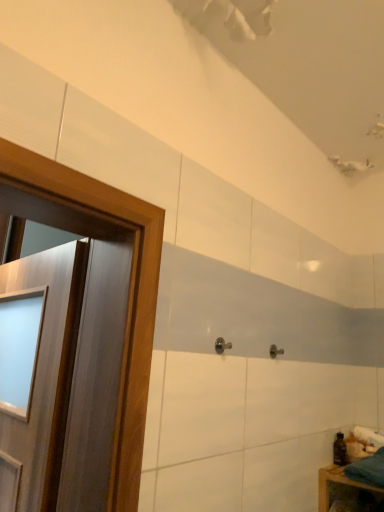
The width and height of the screenshot is (384, 512). In order to click on satin nickel door handle at center in this screenshot , I will do [x=221, y=345].

Where is `teal fabric at lower right`? The width and height of the screenshot is (384, 512). teal fabric at lower right is located at coordinates (346, 492).

The height and width of the screenshot is (512, 384). Describe the element at coordinates (46, 370) in the screenshot. I see `wooden door at left` at that location.

Locate an element on the screen. The height and width of the screenshot is (512, 384). satin nickel door handle at center is located at coordinates (221, 345).

In terms of size, does transparent plastic bottle at lower right appear bigger or smaller than wooden door at left?

In the image, transparent plastic bottle at lower right appears to be smaller than wooden door at left.

Would you say transparent plastic bottle at lower right is outside wooden door at left?

Yes, transparent plastic bottle at lower right is not within wooden door at left.

What's the angular difference between transparent plastic bottle at lower right and wooden door at left's facing directions?

9.71 degrees separate the facing orientations of transparent plastic bottle at lower right and wooden door at left.

Which is closer, (342, 435) or (46, 320)?

Positioned in front is point (46, 320).

From a real-world perspective, does teal fabric at lower right sit lower than transparent plastic bottle at lower right?

Yes, from a real-world perspective, teal fabric at lower right is below transparent plastic bottle at lower right.

Are teal fabric at lower right and transparent plastic bottle at lower right making contact?

There is a gap between teal fabric at lower right and transparent plastic bottle at lower right.

Considering the relative positions of teal fabric at lower right and transparent plastic bottle at lower right in the image provided, is teal fabric at lower right behind transparent plastic bottle at lower right?

No, teal fabric at lower right is in front of transparent plastic bottle at lower right.

Is point (319, 475) closer to viewer compared to point (341, 464)?

Yes, point (319, 475) is closer to viewer.

Is teal fabric at lower right taller than wooden door at left?

Incorrect, the height of teal fabric at lower right is not larger of that of wooden door at left.

From the image's perspective, is teal fabric at lower right on top of wooden door at left?

Incorrect, from the image's perspective, teal fabric at lower right is lower than wooden door at left.

Does point (354, 487) appear closer or farther from the camera than point (12, 456)?

Point (354, 487).

Is teal fabric at lower right positioned before wooden door at left?

No, it is behind wooden door at left.

From the image's perspective, would you say teal fabric at lower right is shown under satin nickel door handle at center?

Yes.

Which is nearer, [355,487] or [228,342]?

Point [228,342]

Is teal fabric at lower right bigger than satin nickel door handle at center?

Yes.

Is satin nickel door handle at center not inside wooden door at left?

Indeed, satin nickel door handle at center is completely outside wooden door at left.

From their relative heights in the image, would you say satin nickel door handle at center is taller or shorter than wooden door at left?

In the image, satin nickel door handle at center appears to be shorter than wooden door at left.

Is satin nickel door handle at center smaller than wooden door at left?

Yes.

Considering the relative positions of satin nickel door handle at center and wooden door at left in the image provided, is satin nickel door handle at center to the left or to the right of wooden door at left?

From the image, it's evident that satin nickel door handle at center is to the right of wooden door at left.

How different are the orientations of transparent plastic bottle at lower right and satin nickel door handle at center in degrees?

transparent plastic bottle at lower right and satin nickel door handle at center are facing 89.8 degrees away from each other.

Looking at their sizes, would you say transparent plastic bottle at lower right is wider or thinner than satin nickel door handle at center?

Clearly, transparent plastic bottle at lower right has more width compared to satin nickel door handle at center.

Considering the relative sizes of transparent plastic bottle at lower right and satin nickel door handle at center in the image provided, is transparent plastic bottle at lower right shorter than satin nickel door handle at center?

No.

Between point (59, 478) and point (342, 436), which one is positioned in front?

The point (59, 478) is closer to the camera.

Could you tell me if wooden door at left is facing transparent plastic bottle at lower right?

No, wooden door at left does not turn towards transparent plastic bottle at lower right.

From a real-world perspective, who is located lower, wooden door at left or transparent plastic bottle at lower right?

From a 3D spatial view, transparent plastic bottle at lower right is below.

Which object is positioned more to the left, wooden door at left or transparent plastic bottle at lower right?

wooden door at left is more to the left.

The height and width of the screenshot is (512, 384). I want to click on toiletry that appears below the wooden door at left (from the image's perspective), so click(x=339, y=450).

In the image, there is a teal fabric at lower right. At what (x,y) coordinates should I click in order to perform the action: click on toiletry above it (from the image's perspective). Please return your answer as a coordinate pair (x, y). This screenshot has width=384, height=512. Looking at the image, I should click on (339, 450).

Which object lies further to the anchor point transparent plastic bottle at lower right, teal fabric at lower right or satin nickel door handle at center?

satin nickel door handle at center is further to transparent plastic bottle at lower right.

Looking at this image, estimate the real-world distances between objects in this image. Which object is further from teal fabric at lower right, wooden door at left or satin nickel door handle at center?

Among the two, wooden door at left is located further to teal fabric at lower right.

Estimate the real-world distances between objects in this image. Which object is closer to wooden door at left, teal fabric at lower right or transparent plastic bottle at lower right?

Among the two, teal fabric at lower right is located nearer to wooden door at left.

Looking at this image, when comparing their distances from wooden door at left, does satin nickel door handle at center or transparent plastic bottle at lower right seem further?

transparent plastic bottle at lower right lies further to wooden door at left than the other object.

From the image, which object appears to be nearer to wooden door at left, satin nickel door handle at center or teal fabric at lower right?

satin nickel door handle at center lies closer to wooden door at left than the other object.

When comparing their distances from wooden door at left, does transparent plastic bottle at lower right or teal fabric at lower right seem closer?

teal fabric at lower right.

When comparing their distances from satin nickel door handle at center, does teal fabric at lower right or wooden door at left seem closer?

The object closer to satin nickel door handle at center is wooden door at left.

Which object lies further to the anchor point satin nickel door handle at center, transparent plastic bottle at lower right or teal fabric at lower right?

Among the two, teal fabric at lower right is located further to satin nickel door handle at center.

Identify the location of toiletry between satin nickel door handle at center and teal fabric at lower right in the horizontal direction. (339, 450).

The width and height of the screenshot is (384, 512). Find the location of `door handle between wooden door at left and transparent plastic bottle at lower right in the horizontal direction`. door handle between wooden door at left and transparent plastic bottle at lower right in the horizontal direction is located at coordinates (221, 345).

Identify the location of toiletry located between wooden door at left and teal fabric at lower right in the left-right direction. (339, 450).

At what (x,y) coordinates should I click in order to perform the action: click on door handle between wooden door at left and teal fabric at lower right from left to right. Please return your answer as a coordinate pair (x, y). The height and width of the screenshot is (512, 384). Looking at the image, I should click on (221, 345).